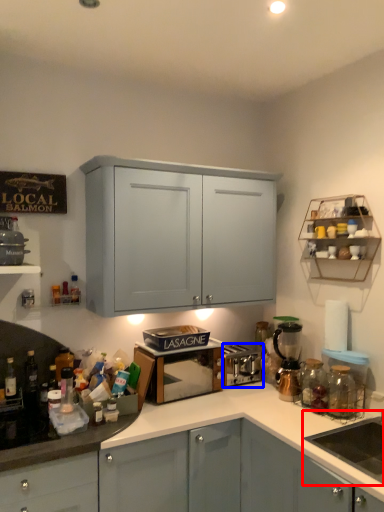
Question: Which point is further to the camera, sink (highlighted by a red box) or appliance (highlighted by a blue box)?

Choices:
 (A) sink
 (B) appliance

Answer: (B)